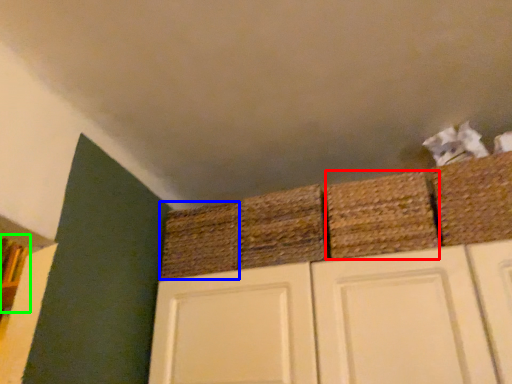
Question: Based on their relative distances, which object is farther from basket (highlighted by a red box)? Choose from basket (highlighted by a blue box) and shelf (highlighted by a green box).

Choices:
 (A) basket
 (B) shelf

Answer: (B)